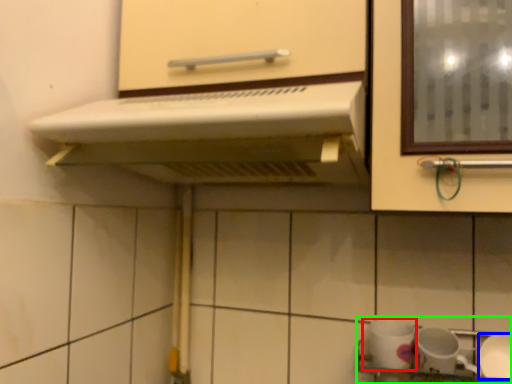
Question: Considering the real-world distances, which object is closest to tableware (highlighted by a red box)? tableware (highlighted by a blue box) or sink (highlighted by a green box).

Choices:
 (A) tableware
 (B) sink

Answer: (B)